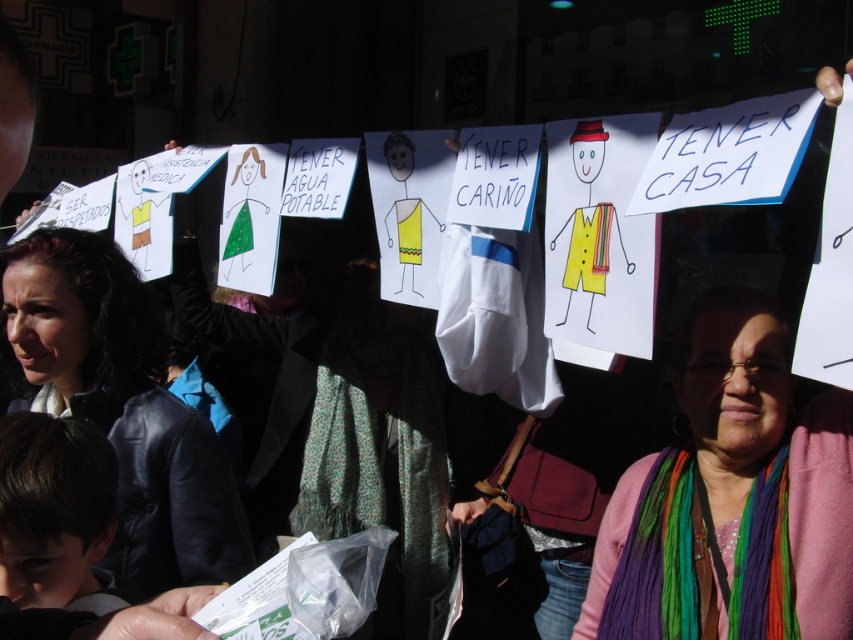
You are a photographer taking a picture of the protest scene. You notice the multicolored scarf at center and the matte black jacket at left. Which object should you focus on first to ensure both are in sharp focus?

You should focus on the multicolored scarf at center first because it is closer to the viewer than the matte black jacket at left. By focusing on the closer object, the depth of field may include the farther object as well, ensuring both are in sharp focus.